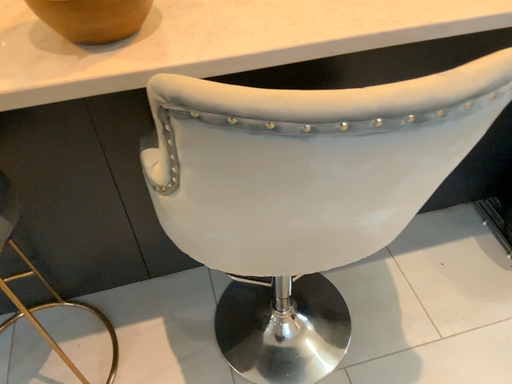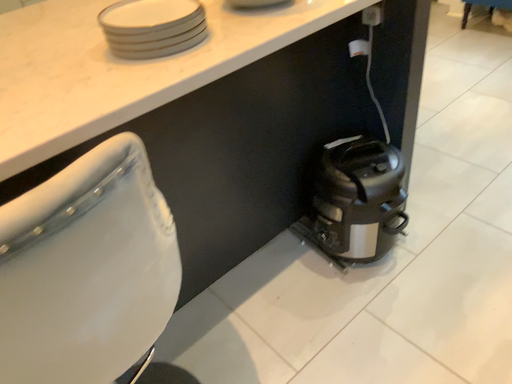
Question: Which way did the camera rotate in the video?

Choices:
 (A) rotated right
 (B) rotated left

Answer: (A)